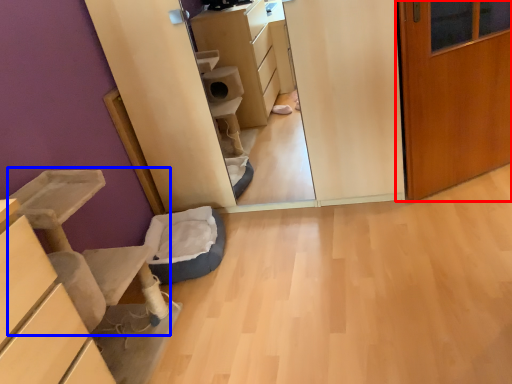
Question: Which point is closer to the camera, door (highlighted by a red box) or furniture (highlighted by a blue box)?

Choices:
 (A) door
 (B) furniture

Answer: (B)